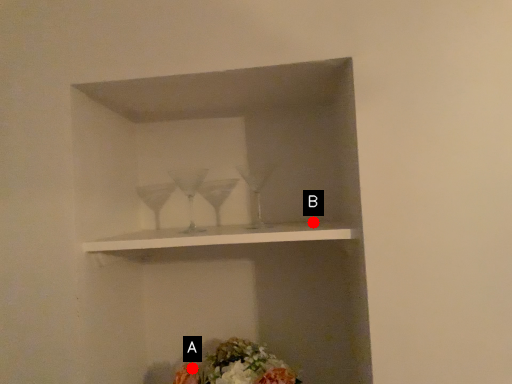
Question: Two points are circled on the image, labeled by A and B beside each circle. Which point is closer to the camera?

Choices:
 (A) A is closer
 (B) B is closer

Answer: (A)